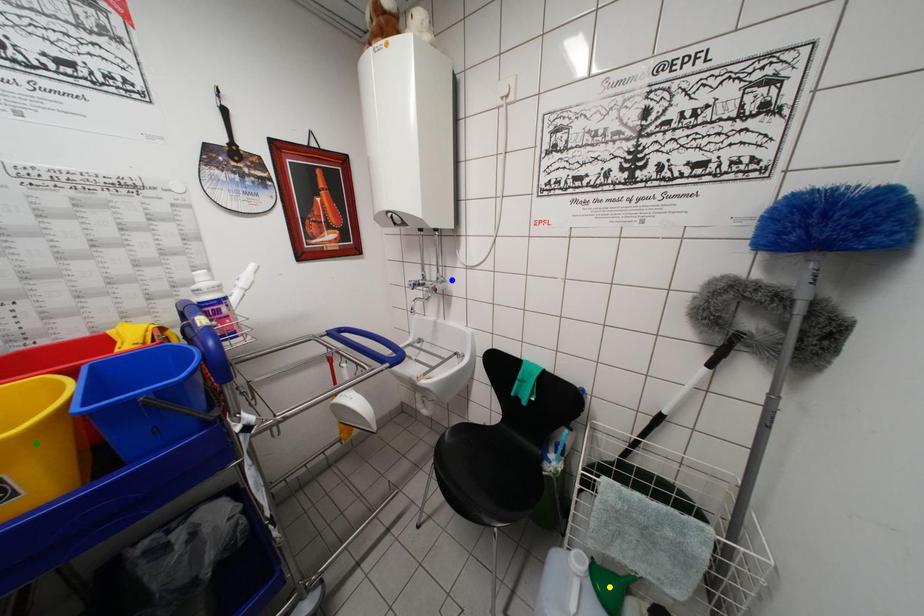
Order these from farthest to nearest:
- blue point
- green point
- yellow point

blue point → yellow point → green point